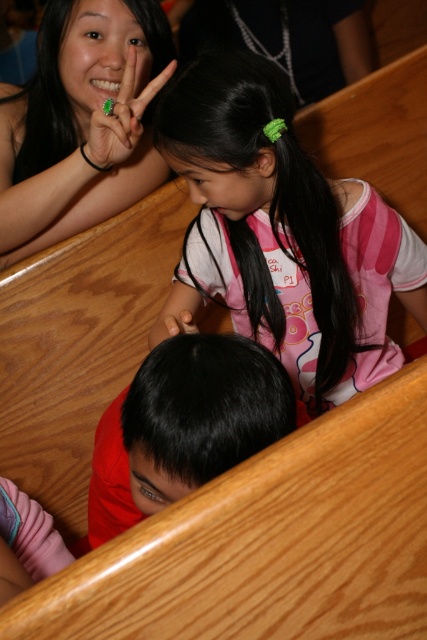
Can you confirm if pink cotton shirt at center is thinner than green matte ring at upper left?

In fact, pink cotton shirt at center might be wider than green matte ring at upper left.

Is pink cotton shirt at center positioned in front of green matte ring at upper left?

Yes, pink cotton shirt at center is closer to the viewer.

Does point (192, 264) lie in front of point (126, 90)?

No, it is behind (126, 90).

In order to click on pink cotton shirt at center in this screenshot , I will do `click(283, 234)`.

Can you confirm if matte black hand at upper left is taller than green matte ring at upper left?

Indeed, matte black hand at upper left has a greater height compared to green matte ring at upper left.

You are a GUI agent. You are given a task and a screenshot of the screen. Output one action in this format:
    pyautogui.click(x=<x>, y=<y>)
    Task: Click on the matte black hand at upper left
    This screenshot has width=427, height=640.
    Given the screenshot: What is the action you would take?
    pyautogui.click(x=81, y=122)

Identify the location of matte black hand at upper left. (81, 122).

Can you confirm if smooth red shirt at lower center is positioned above green matte ring at upper left?

Incorrect, smooth red shirt at lower center is not positioned above green matte ring at upper left.

Is smooth red shirt at lower center below green matte ring at upper left?

Yes, smooth red shirt at lower center is below green matte ring at upper left.

Find the location of a particular element. The height and width of the screenshot is (640, 427). smooth red shirt at lower center is located at coordinates (184, 422).